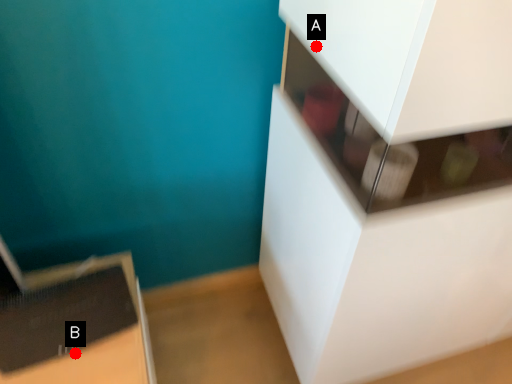
Question: Two points are circled on the image, labeled by A and B beside each circle. Which point is farther to the camera?

Choices:
 (A) A is further
 (B) B is further

Answer: (B)